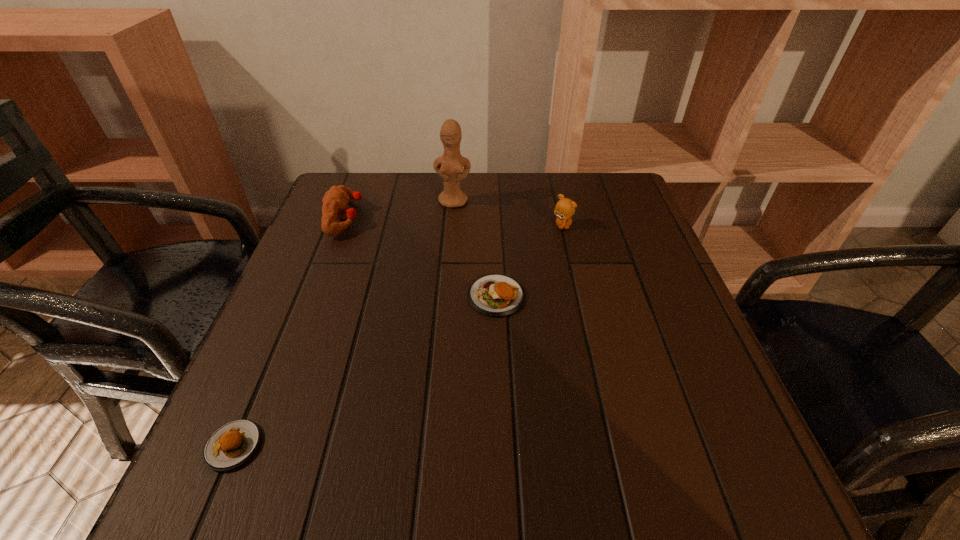
In order to click on vacant point located between the left food and the rightmost object in this screenshot , I will do `click(397, 335)`.

You are a GUI agent. You are given a task and a screenshot of the screen. Output one action in this format:
    pyautogui.click(x=<x>, y=<y>)
    Task: Click on the free space between the shortest object and the rightmost object
    Image resolution: width=960 pixels, height=540 pixels.
    Given the screenshot: What is the action you would take?
    pyautogui.click(x=397, y=335)

I want to click on empty space that is in between the puncher and the left food, so click(x=289, y=332).

Locate an element on the screen. Image resolution: width=960 pixels, height=540 pixels. vacant area between the rightmost object and the puncher is located at coordinates (454, 221).

The width and height of the screenshot is (960, 540). Identify the location of free space between the rightmost object and the taller food. (529, 261).

You are a GUI agent. You are given a task and a screenshot of the screen. Output one action in this format:
    pyautogui.click(x=<x>, y=<y>)
    Task: Click on the free space between the shortest object and the taller food
    
    Given the screenshot: What is the action you would take?
    tap(365, 371)

Locate an element on the screen. This screenshot has width=960, height=540. unoccupied area between the third tallest object and the figurine is located at coordinates (399, 210).

Identify the location of the closest object to the third shortest object. (449, 167).

What are the coordinates of `object that can be found as the closest to the shortest object` in the screenshot? It's located at (495, 295).

At what (x,y) coordinates should I click in order to perform the action: click on free space in the image that satisfies the following two spatial constraints: 1. with the gloves of the second nearest object facing forward; 2. on the right side of the third tallest object. Please return your answer as a coordinate pair (x, y). The image size is (960, 540). Looking at the image, I should click on (316, 296).